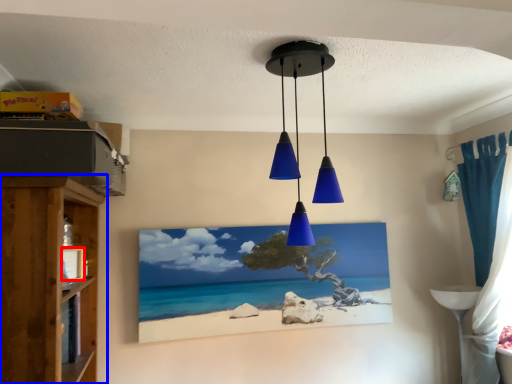
Question: Which object is closer to the camera taking this photo, picture frame (highlighted by a red box) or shelf (highlighted by a blue box)?

Choices:
 (A) picture frame
 (B) shelf

Answer: (B)